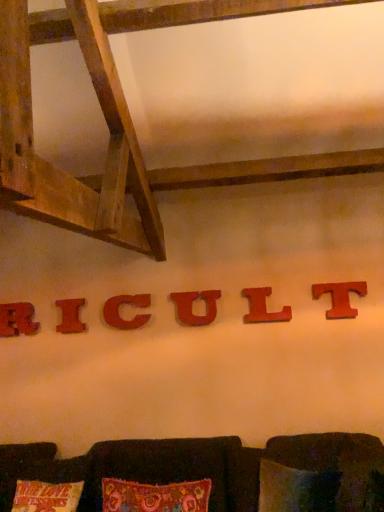
Question: Considering the positions of red matte letter l at center, the fifth alphabet viewed from the left, and brown fabric couch at lower center in the image, is red matte letter l at center, the fifth alphabet viewed from the left, bigger or smaller than brown fabric couch at lower center?

Choices:
 (A) small
 (B) big

Answer: (A)

Question: From a real-world perspective, is red matte letter l at center, the second alphabet from the right, physically located above or below brown fabric couch at lower center?

Choices:
 (A) above
 (B) below

Answer: (A)

Question: Which object is the farthest from the brown fabric couch at lower center?

Choices:
 (A) red matte letter l at center, the fifth alphabet viewed from the left
 (B) red matte u at center, which ranks as the 4th alphabet in left-to-right order
 (C) red wood letter t at center right, which is counted as the first alphabet, starting from the right
 (D) wooden letter c at center, placed as the 3th alphabet when sorted from left to right
 (E) wooden letter r at center, which ranks as the first alphabet in left-to-right order

Answer: (E)

Question: Considering the real-world distances, which object is farthest from the wooden letter c at center, the fourth alphabet viewed from the right?

Choices:
 (A) red matte u at center, the 3th alphabet when ordered from right to left
 (B) red wood letter t at center right, which is counted as the sixth alphabet, starting from the left
 (C) wooden letter r at center, which ranks as the first alphabet in left-to-right order
 (D) brown fabric couch at lower center
 (E) red matte letter l at center, the fifth alphabet viewed from the left

Answer: (B)